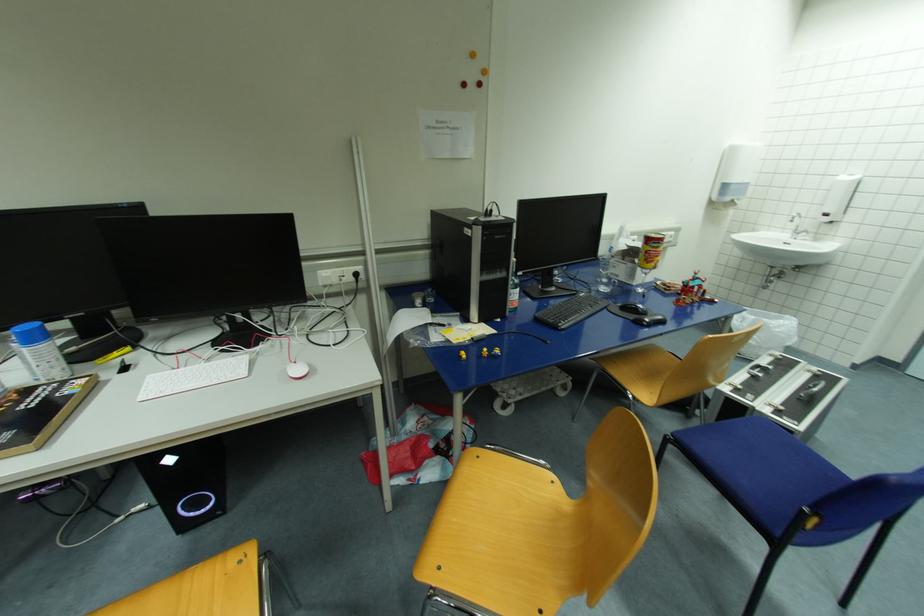
Where would you typ the black keyboard? Please return your answer as a coordinate pair (x, y).

(570, 310)